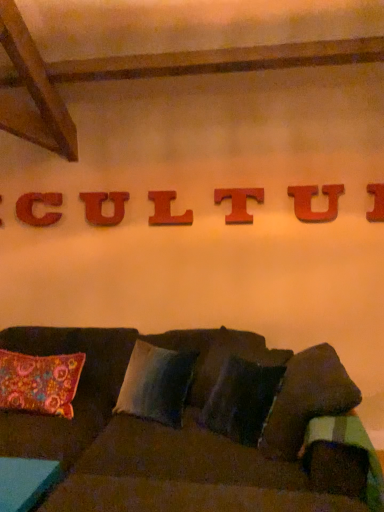
What is the approximate width of wooden letter c at upper center, acting as the 2th letter starting from the left?

The width of wooden letter c at upper center, acting as the 2th letter starting from the left, is 2.82 inches.

Describe the element at coordinates (40, 382) in the screenshot. I see `floral fabric pillow at left, the 1th pillow viewed from the left` at that location.

Describe the element at coordinates (101, 207) in the screenshot. I see `wooden letter u at center, which is the fifth letter in right-to-left order` at that location.

Where is `wooden letter c at upper center, acting as the 2th letter starting from the left`? wooden letter c at upper center, acting as the 2th letter starting from the left is located at coordinates (32, 208).

Does floral fabric pillow at left, the 1th pillow viewed from the left, come behind wooden letter u at center, which is the third letter in left-to-right order?

That is False.

Where is `the 2nd pillow below the wooden letter u at center, which is the third letter in left-to-right order (from the image's perspective)`? The width and height of the screenshot is (384, 512). the 2nd pillow below the wooden letter u at center, which is the third letter in left-to-right order (from the image's perspective) is located at coordinates (40, 382).

Is floral fabric pillow at left, the 1th pillow viewed from the left, positioned beyond the bounds of wooden letter u at center, which is the fifth letter in right-to-left order?

That's correct, floral fabric pillow at left, the 1th pillow viewed from the left, is outside of wooden letter u at center, which is the fifth letter in right-to-left order.

From a real-world perspective, is floral fabric pillow at left, the 1th pillow viewed from the left, located beneath wooden letter u at center, which is the third letter in left-to-right order?

Yes, from a real-world perspective, floral fabric pillow at left, the 1th pillow viewed from the left, is under wooden letter u at center, which is the third letter in left-to-right order.

From the image's perspective, is wooden letter t at center, which appears as the 3th letter when viewed from the right, over wooden letter l at center, which is counted as the fourth letter, starting from the left?

Yes, from the image's perspective, wooden letter t at center, which appears as the 3th letter when viewed from the right, is over wooden letter l at center, which is counted as the fourth letter, starting from the left.

How different are the orientations of wooden letter t at center, which is the 5th letter in left-to-right order, and wooden letter l at center, which ranks as the 4th letter in right-to-left order, in degrees?

They differ by 0.0273 degrees in their facing directions.

Are wooden letter t at center, which appears as the 3th letter when viewed from the right, and wooden letter l at center, which ranks as the 4th letter in right-to-left order, located far from each other?

Actually, wooden letter t at center, which appears as the 3th letter when viewed from the right, and wooden letter l at center, which ranks as the 4th letter in right-to-left order, are a little close together.

Considering the sizes of objects wooden letter at upper center, arranged as the 1th letter when viewed from the left, and wooden letter l at center, which ranks as the 4th letter in right-to-left order, in the image provided, who is taller, wooden letter at upper center, arranged as the 1th letter when viewed from the left, or wooden letter l at center, which ranks as the 4th letter in right-to-left order,?

wooden letter l at center, which ranks as the 4th letter in right-to-left order, is taller.

Considering the positions of points (0, 203) and (160, 204), is point (0, 203) closer to camera compared to point (160, 204)?

No, it is not.

Does floral fabric pillow at left, which ranks as the 2th pillow in right-to-left order, contain wooden letter c at upper center, acting as the 2th letter starting from the left?

No, wooden letter c at upper center, acting as the 2th letter starting from the left, is not surrounded by floral fabric pillow at left, which ranks as the 2th pillow in right-to-left order.

Is point (0, 365) farther from viewer compared to point (26, 214)?

No, it is in front of (26, 214).

Considering the sizes of objects floral fabric pillow at left, the 1th pillow viewed from the left, and wooden letter c at upper center, acting as the 2th letter starting from the left, in the image provided, who is thinner, floral fabric pillow at left, the 1th pillow viewed from the left, or wooden letter c at upper center, acting as the 2th letter starting from the left,?

Thinner between the two is wooden letter c at upper center, acting as the 2th letter starting from the left.

Is floral fabric pillow at left, the 1th pillow viewed from the left, to the right of wooden letter c at upper center, which ranks as the sixth letter in right-to-left order, from the viewer's perspective?

Indeed, floral fabric pillow at left, the 1th pillow viewed from the left, is positioned on the right side of wooden letter c at upper center, which ranks as the sixth letter in right-to-left order.

Is dark fabric couch at center oriented away from wooden letter c at upper center, which ranks as the sixth letter in right-to-left order?

dark fabric couch at center does not have its back to wooden letter c at upper center, which ranks as the sixth letter in right-to-left order.

Between dark fabric couch at center and wooden letter c at upper center, acting as the 2th letter starting from the left, which one appears on the left side from the viewer's perspective?

wooden letter c at upper center, acting as the 2th letter starting from the left, is more to the left.

Is dark fabric couch at center further to camera compared to wooden letter c at upper center, acting as the 2th letter starting from the left?

No, the depth of dark fabric couch at center is less than that of wooden letter c at upper center, acting as the 2th letter starting from the left.

Looking at the image, does dark fabric couch at center seem bigger or smaller compared to wooden letter c at upper center, acting as the 2th letter starting from the left?

Clearly, dark fabric couch at center is larger in size than wooden letter c at upper center, acting as the 2th letter starting from the left.

Between wooden letter t at center, which is the 5th letter in left-to-right order, and dark fabric couch at center, which one has smaller width?

With smaller width is wooden letter t at center, which is the 5th letter in left-to-right order.

Does wooden letter t at center, which is the 5th letter in left-to-right order, appear on the right side of dark fabric couch at center?

Correct, you'll find wooden letter t at center, which is the 5th letter in left-to-right order, to the right of dark fabric couch at center.

Is wooden letter t at center, which appears as the 3th letter when viewed from the right, far away from dark fabric couch at center?

Indeed, wooden letter t at center, which appears as the 3th letter when viewed from the right, is not near dark fabric couch at center.

Would you consider wooden letter i at upper center, which is the 1th letter in right-to-left order, to be distant from velvety blue pillow at center, which ranks as the first pillow in right-to-left order?

wooden letter i at upper center, which is the 1th letter in right-to-left order, is far away from velvety blue pillow at center, which ranks as the first pillow in right-to-left order.

From a real-world perspective, which object rests below the other?

velvety blue pillow at center, which ranks as the first pillow in right-to-left order.

Find the location of a particular element. Image resolution: width=384 pixels, height=512 pixels. the 4th letter counting from the right of the velvety blue pillow at center, which ranks as the first pillow in right-to-left order is located at coordinates (376, 202).

From the image's perspective, relative to velvety blue pillow at center, which ranks as the second pillow in left-to-right order, is wooden letter i at upper center, which ranks as the 7th letter in left-to-right order, above or below?

wooden letter i at upper center, which ranks as the 7th letter in left-to-right order, is situated higher than velvety blue pillow at center, which ranks as the second pillow in left-to-right order, in the image.

What are the coordinates of `letter that is the 3rd one above the floral fabric pillow at left, the 1th pillow viewed from the left (from a real-world perspective)` in the screenshot? It's located at (101, 207).

Find the location of a particular element. The image size is (384, 512). the 3rd letter positioned below the wooden letter t at center, which is the 5th letter in left-to-right order (from the image's perspective) is located at coordinates (167, 210).

Estimate the real-world distances between objects in this image. Which object is closer to dark fabric couch at center, wooden letter i at upper center, which is the 1th letter in right-to-left order, or floral fabric pillow at left, which ranks as the 2th pillow in right-to-left order?

floral fabric pillow at left, which ranks as the 2th pillow in right-to-left order.

Looking at the image, which one is located further to dark fabric couch at center, velvety blue pillow at center, which ranks as the first pillow in right-to-left order, or floral fabric pillow at left, the 1th pillow viewed from the left?

Among the two, floral fabric pillow at left, the 1th pillow viewed from the left, is located further to dark fabric couch at center.

Estimate the real-world distances between objects in this image. Which object is further from velvety blue pillow at center, which ranks as the first pillow in right-to-left order, floral fabric pillow at left, which ranks as the 2th pillow in right-to-left order, or wooden letter l at center, which is counted as the fourth letter, starting from the left?

wooden letter l at center, which is counted as the fourth letter, starting from the left, is positioned further to the anchor velvety blue pillow at center, which ranks as the first pillow in right-to-left order.

Which object lies nearer to the anchor point floral fabric pillow at left, which ranks as the 2th pillow in right-to-left order, velvety blue pillow at center, which ranks as the second pillow in left-to-right order, or wooden letter t at center, which appears as the 3th letter when viewed from the right?

Based on the image, velvety blue pillow at center, which ranks as the second pillow in left-to-right order, appears to be nearer to floral fabric pillow at left, which ranks as the 2th pillow in right-to-left order.

Considering their positions, is wooden letter t at center, which appears as the 3th letter when viewed from the right, positioned closer to wooden letter l at center, which ranks as the 4th letter in right-to-left order, than floral fabric pillow at left, which ranks as the 2th pillow in right-to-left order?

wooden letter t at center, which appears as the 3th letter when viewed from the right.

From the image, which object appears to be nearer to wooden letter u at center, which is the third letter in left-to-right order, wooden letter t at center, which is the 5th letter in left-to-right order, or wooden letter at upper center, arranged as the 1th letter when viewed from the left?

The object closer to wooden letter u at center, which is the third letter in left-to-right order, is wooden letter t at center, which is the 5th letter in left-to-right order.

Estimate the real-world distances between objects in this image. Which object is closer to wooden letter u at upper center, marked as the second letter in a right-to-left arrangement, wooden letter t at center, which appears as the 3th letter when viewed from the right, or velvety blue pillow at center, which ranks as the first pillow in right-to-left order?

wooden letter t at center, which appears as the 3th letter when viewed from the right, lies closer to wooden letter u at upper center, marked as the second letter in a right-to-left arrangement, than the other object.

From the image, which object appears to be nearer to wooden letter u at upper center, the sixth letter viewed from the left, wooden letter t at center, which is the 5th letter in left-to-right order, or wooden letter at upper center, arranged as the 1th letter when viewed from the left?

wooden letter t at center, which is the 5th letter in left-to-right order, is closer to wooden letter u at upper center, the sixth letter viewed from the left.

Find the location of a particular element. The image size is (384, 512). pillow between wooden letter u at center, which is the third letter in left-to-right order, and wooden letter u at upper center, marked as the second letter in a right-to-left arrangement is located at coordinates (156, 384).

The height and width of the screenshot is (512, 384). I want to click on letter between dark fabric couch at center and wooden letter u at upper center, the sixth letter viewed from the left, in the front-back direction, so 376,202.

The width and height of the screenshot is (384, 512). I want to click on letter situated between wooden letter at upper center, arranged as the 1th letter when viewed from the left, and wooden letter u at center, which is the fifth letter in right-to-left order, from left to right, so click(32, 208).

The image size is (384, 512). I want to click on studio couch between wooden letter at upper center, which ranks as the seventh letter in right-to-left order, and wooden letter i at upper center, which ranks as the 7th letter in left-to-right order, in the horizontal direction, so click(x=196, y=425).